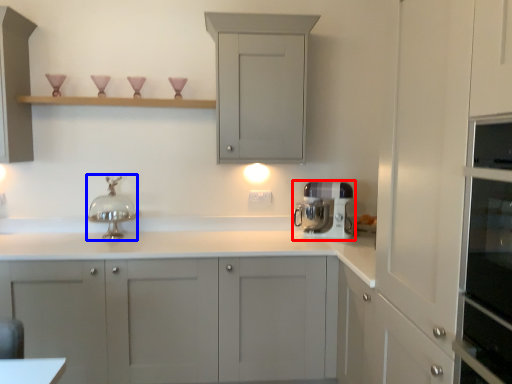
Question: Among these objects, which one is nearest to the camera, home appliance (highlighted by a red box) or faucet (highlighted by a blue box)?

Choices:
 (A) home appliance
 (B) faucet

Answer: (B)